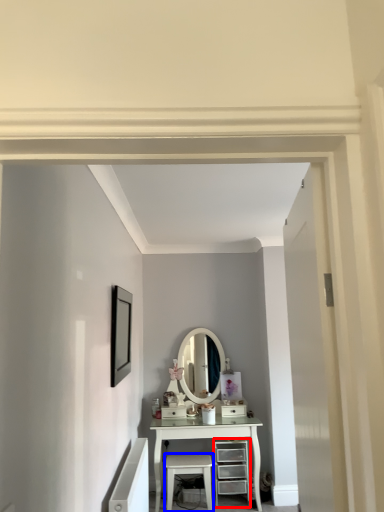
Question: Which object is closer to the camera taking this photo, chest of drawers (highlighted by a red box) or stool (highlighted by a blue box)?

Choices:
 (A) chest of drawers
 (B) stool

Answer: (B)